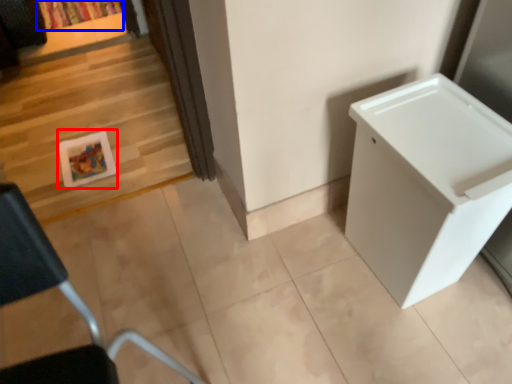
Question: Which of the following is the farthest to the observer, picture frame (highlighted by a red box) or curtain (highlighted by a blue box)?

Choices:
 (A) picture frame
 (B) curtain

Answer: (B)